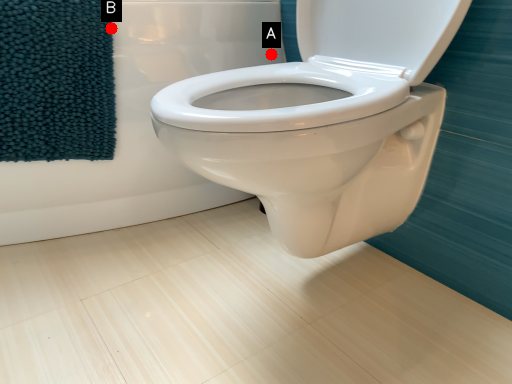
Question: Two points are circled on the image, labeled by A and B beside each circle. Which point is farther to the camera?

Choices:
 (A) A is further
 (B) B is further

Answer: (A)